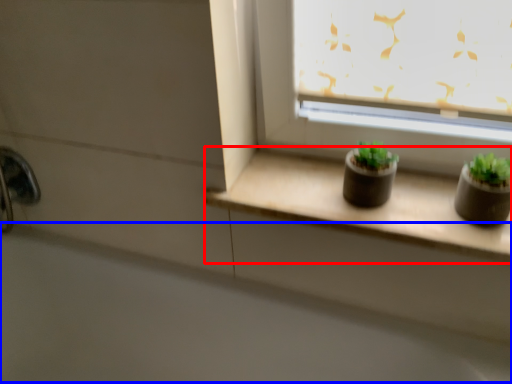
Question: Which point is closer to the camera, window sill (highlighted by a red box) or bath (highlighted by a blue box)?

Choices:
 (A) window sill
 (B) bath

Answer: (B)